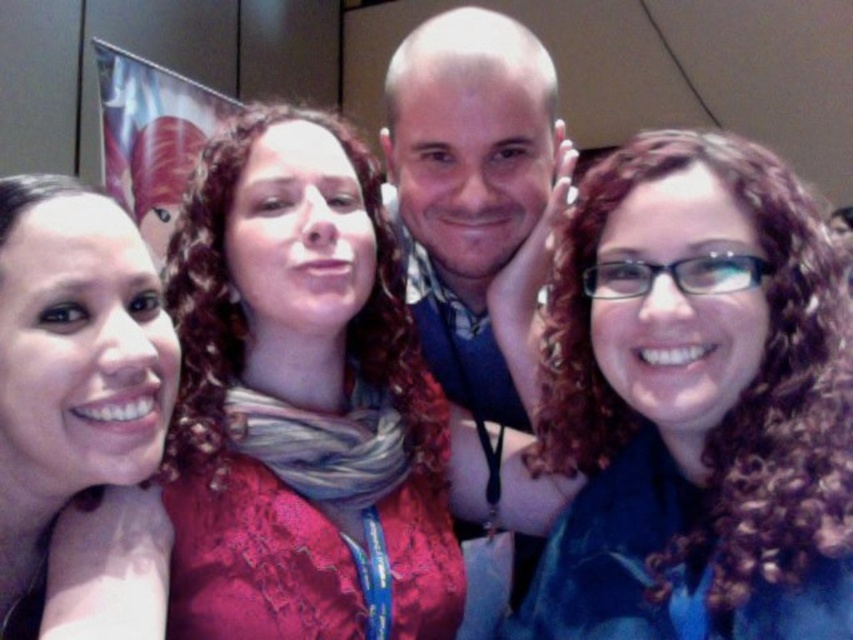
You are a photographer trying to adjust the lighting for a group photo. You notice two elements at the center of the image that might cast shadows. The matte blue scarf at center and the smooth skin head at center. Which of these two items is positioned higher and might cast a longer shadow?

The matte blue scarf at center is taller than the smooth skin head at center, so it is positioned higher and might cast a longer shadow.

You are organizing a charity event and need to ensure that all donated items fit into a display case. The display case has a maximum width of 1 meter. You have two items to place inside the case. The first item is the matte red lace dress at center, and the second item is the matte pink scarf at left. Based on the image, can both items fit side by side within the display case?

The matte red lace dress at center is bigger than the matte pink scarf at left. Since the display case has a maximum width of 1 meter, but the exact sizes of the items are not provided, it is uncertain if they can fit side by side. Additional measurements are needed to determine their combined width.